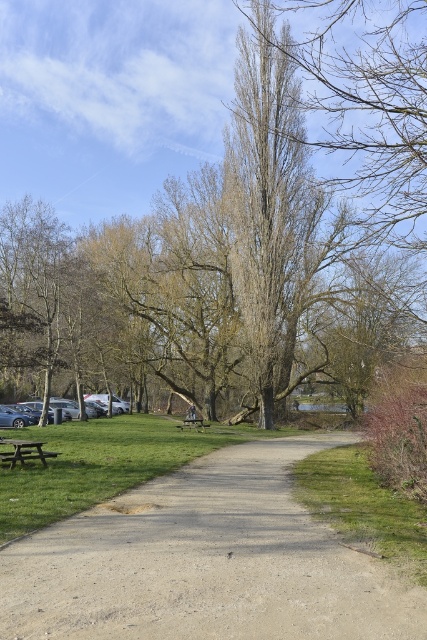
You are standing at the picnic table near the parked cars and want to walk to the green grass at lower right. According to the coordinates provided, in which general direction should you head?

The green grass at lower right is located at coordinates point (x=362, y=506), so you should head towards the lower right direction from your current position at the picnic table near the parked cars.

You are standing at the camera position in the park scene. There is a point marked at coordinates point (41, 499). Can you reach this point by walking straight ahead without deviating from your current position?

The point (41, 499) is 32.17 feet away from the camera, so yes, you can reach it by walking straight ahead since it is within a reachable distance.

You are standing at the edge of the park pathway and want to sit down. Which object, the green grass at lower right or the wooden park bench at center, is nearer to you where you can sit comfortably?

The green grass at lower right is closer to the viewer than the wooden park bench at center, so you can sit there first.